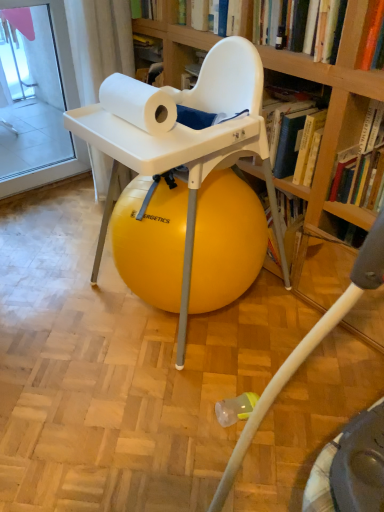
At what (x,y) coordinates should I click in order to perform the action: click on white matte paper towel at upper center. Please return your answer as a coordinate pair (x, y). The image size is (384, 512). Looking at the image, I should click on (138, 103).

Describe the element at coordinates (301, 26) in the screenshot. I see `hardcover book at upper center, marked as the 1th book in a top-to-bottom arrangement` at that location.

What do you see at coordinates (361, 163) in the screenshot?
I see `hardcover book at upper right, acting as the 1th book starting from the right` at bounding box center [361, 163].

Locate an element on the screen. The image size is (384, 512). white matte paper towel at upper center is located at coordinates (138, 103).

Looking at the image, does white matte paper towel at upper center seem bigger or smaller compared to hardcover book at upper center, the 2th book positioned from the bottom?

Considering their sizes, white matte paper towel at upper center takes up less space than hardcover book at upper center, the 2th book positioned from the bottom.

Considering the relative sizes of white matte paper towel at upper center and hardcover book at upper center, the 2th book positioned from the bottom, in the image provided, is white matte paper towel at upper center taller than hardcover book at upper center, the 2th book positioned from the bottom,?

Incorrect, the height of white matte paper towel at upper center is not larger of that of hardcover book at upper center, the 2th book positioned from the bottom.

Does white matte paper towel at upper center have a greater width compared to hardcover book at upper center, marked as the 1th book in a top-to-bottom arrangement?

No, white matte paper towel at upper center is not wider than hardcover book at upper center, marked as the 1th book in a top-to-bottom arrangement.

From the image's perspective, does white matte paper towel at upper center appear lower than hardcover book at upper center, the 2th book when ordered from right to left?

Yes.

Is white matte paper towel at upper center aimed at yellow rubber ball at center?

No, white matte paper towel at upper center is not facing towards yellow rubber ball at center.

From a real-world perspective, which object rests below the other?

yellow rubber ball at center is physically lower.

From their relative heights in the image, would you say white matte paper towel at upper center is taller or shorter than yellow rubber ball at center?

Clearly, white matte paper towel at upper center is shorter compared to yellow rubber ball at center.

Are white matte paper towel at upper center and yellow rubber ball at center located far from each other?

They are positioned close to each other.

Is hardcover book at upper right, which is the second book in top-to-bottom order, closer to camera compared to white matte paper towel at upper center?

No, it is not.

Is hardcover book at upper right, which appears as the second book when viewed from the left, outside of white matte paper towel at upper center?

Yes, hardcover book at upper right, which appears as the second book when viewed from the left, is outside of white matte paper towel at upper center.

What's the angular difference between hardcover book at upper right, acting as the 1th book starting from the bottom, and white matte paper towel at upper center's facing directions?

The facing directions of hardcover book at upper right, acting as the 1th book starting from the bottom, and white matte paper towel at upper center are 1.32 degrees apart.

From a real-world perspective, is hardcover book at upper right, acting as the 1th book starting from the right, positioned over white matte paper towel at upper center based on gravity?

Actually, hardcover book at upper right, acting as the 1th book starting from the right, is physically below white matte paper towel at upper center in the real world.

Between point (182, 6) and point (129, 122), which one is positioned in front?

The point (129, 122) is closer to the camera.

From the image's perspective, does hardcover book at upper center, the 2th book when ordered from right to left, appear lower than yellow rubber ball at center?

Actually, hardcover book at upper center, the 2th book when ordered from right to left, appears above yellow rubber ball at center in the image.

How different are the orientations of hardcover book at upper center, the 2th book positioned from the bottom, and yellow rubber ball at center in degrees?

hardcover book at upper center, the 2th book positioned from the bottom, and yellow rubber ball at center are facing 90 degrees away from each other.

From a real-world perspective, is hardcover book at upper center, marked as the 1th book in a top-to-bottom arrangement, positioned above or below yellow rubber ball at center?

In terms of real-world spatial position, hardcover book at upper center, marked as the 1th book in a top-to-bottom arrangement, is above yellow rubber ball at center.

Which of these two, yellow rubber ball at center or hardcover book at upper right, acting as the 1th book starting from the bottom, stands shorter?

hardcover book at upper right, acting as the 1th book starting from the bottom, is shorter.

Which is in front, point (168, 86) or point (366, 160)?

The point (366, 160) is closer.

Which object is closer to the camera taking this photo, yellow rubber ball at center or hardcover book at upper right, which appears as the second book when viewed from the left?

Positioned in front is yellow rubber ball at center.

From the image's perspective, is white matte paper towel at upper center positioned above or below hardcover book at upper right, acting as the 1th book starting from the bottom?

Clearly, from the image's perspective, white matte paper towel at upper center is above hardcover book at upper right, acting as the 1th book starting from the bottom.

Is white matte paper towel at upper center smaller than hardcover book at upper right, which is the second book in top-to-bottom order?

Correct, white matte paper towel at upper center occupies less space than hardcover book at upper right, which is the second book in top-to-bottom order.

I want to click on book beneath the white matte paper towel at upper center (from a real-world perspective), so click(x=361, y=163).

Is white matte paper towel at upper center not close to hardcover book at upper right, which is the second book in top-to-bottom order?

No, there isn't a large distance between white matte paper towel at upper center and hardcover book at upper right, which is the second book in top-to-bottom order.

Can you tell me how much hardcover book at upper right, acting as the 1th book starting from the right, and yellow rubber ball at center differ in facing direction?

The facing directions of hardcover book at upper right, acting as the 1th book starting from the right, and yellow rubber ball at center are 90 degrees apart.

Is hardcover book at upper right, acting as the 1th book starting from the right, oriented away from yellow rubber ball at center?

No, hardcover book at upper right, acting as the 1th book starting from the right,'s orientation is not away from yellow rubber ball at center.

From the image's perspective, starting from the yellow rubber ball at center, which book is the 1st one above? Please provide its 2D coordinates.

[(361, 163)]

Identify the location of paper towel that is in front of the hardcover book at upper center, the 2th book when ordered from right to left. (138, 103).

Locate an element on the screen. The width and height of the screenshot is (384, 512). chair lying on the right of white matte paper towel at upper center is located at coordinates (182, 138).

When comparing their distances from white matte paper towel at upper center, does hardcover book at upper right, which is the second book in top-to-bottom order, or yellow rubber ball at center seem further?

hardcover book at upper right, which is the second book in top-to-bottom order, lies further to white matte paper towel at upper center than the other object.

Considering their positions, is white matte paper towel at upper center positioned closer to hardcover book at upper right, acting as the 1th book starting from the right, than yellow rubber ball at center?

yellow rubber ball at center.

Which object lies nearer to the anchor point hardcover book at upper right, which is the second book in top-to-bottom order, white matte paper towel at upper center or hardcover book at upper center, arranged as the 1th book when viewed from the left?

Based on the image, hardcover book at upper center, arranged as the 1th book when viewed from the left, appears to be nearer to hardcover book at upper right, which is the second book in top-to-bottom order.

When comparing their distances from white matte paper towel at upper center, does yellow rubber ball at center or hardcover book at upper center, marked as the 1th book in a top-to-bottom arrangement, seem closer?

Among the two, yellow rubber ball at center is located nearer to white matte paper towel at upper center.

Considering their positions, is yellow rubber ball at center positioned closer to hardcover book at upper right, acting as the 1th book starting from the right, than hardcover book at upper center, the 2th book positioned from the bottom?

hardcover book at upper center, the 2th book positioned from the bottom, is closer to hardcover book at upper right, acting as the 1th book starting from the right.

From the image, which object appears to be nearer to hardcover book at upper right, acting as the 1th book starting from the bottom, yellow rubber ball at center or white matte paper towel at upper center?

Among the two, yellow rubber ball at center is located nearer to hardcover book at upper right, acting as the 1th book starting from the bottom.

Based on their spatial positions, is hardcover book at upper right, acting as the 1th book starting from the bottom, or white matte paper towel at upper center further from yellow rubber ball at center?

hardcover book at upper right, acting as the 1th book starting from the bottom, is further to yellow rubber ball at center.

Based on their spatial positions, is hardcover book at upper center, the 2th book positioned from the bottom, or yellow rubber ball at center closer to white matte paper towel at upper center?

Based on the image, yellow rubber ball at center appears to be nearer to white matte paper towel at upper center.

Locate an element on the screen. The width and height of the screenshot is (384, 512). book between hardcover book at upper center, the 2th book when ordered from right to left, and yellow rubber ball at center vertically is located at coordinates (361, 163).

Identify the location of book located between white matte paper towel at upper center and hardcover book at upper right, acting as the 1th book starting from the right, in the left-right direction. Image resolution: width=384 pixels, height=512 pixels. (301, 26).

Where is `chair between white matte paper towel at upper center and hardcover book at upper right, acting as the 1th book starting from the bottom`? Image resolution: width=384 pixels, height=512 pixels. chair between white matte paper towel at upper center and hardcover book at upper right, acting as the 1th book starting from the bottom is located at coordinates 182,138.

This screenshot has height=512, width=384. In order to click on paper towel between hardcover book at upper center, marked as the 1th book in a top-to-bottom arrangement, and yellow rubber ball at center from top to bottom in this screenshot , I will do `click(138, 103)`.